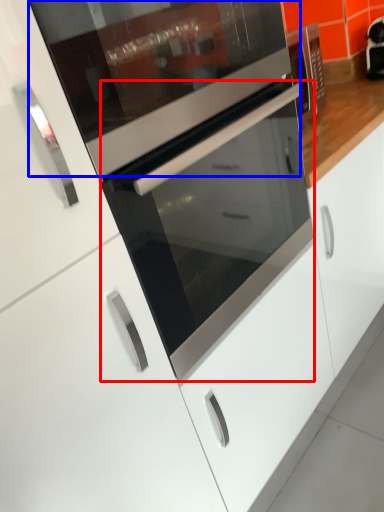
Question: Which object is closer to the camera taking this photo, oven (highlighted by a red box) or appliance (highlighted by a blue box)?

Choices:
 (A) oven
 (B) appliance

Answer: (B)